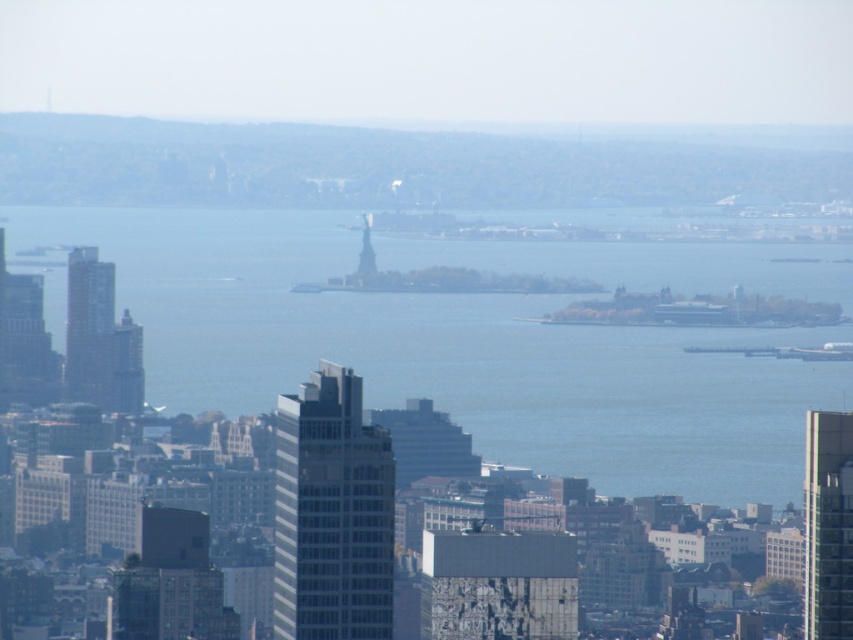
Question: Does white glass building at center come in front of glassy gray skyscraper at right?

Choices:
 (A) yes
 (B) no

Answer: (A)

Question: Estimate the real-world distances between objects in this image. Which object is closer to the polished stainless steel statue at center?

Choices:
 (A) gray glass skyscraper at left
 (B) glassy gray skyscraper at right

Answer: (A)

Question: Which of these objects is positioned farthest from the glassy gray skyscraper at right?

Choices:
 (A) white glass building at center
 (B) polished stainless steel statue at center
 (C) gray glass skyscraper at left
 (D) blue water at center

Answer: (C)

Question: Which object is positioned farthest from the gray glass skyscraper at left?

Choices:
 (A) blue water at center
 (B) glassy gray skyscraper at right

Answer: (B)

Question: Is white glass building at center above glassy gray skyscraper at right?

Choices:
 (A) no
 (B) yes

Answer: (B)

Question: Can you confirm if blue water at center is bigger than gray glass skyscraper at left?

Choices:
 (A) no
 (B) yes

Answer: (B)